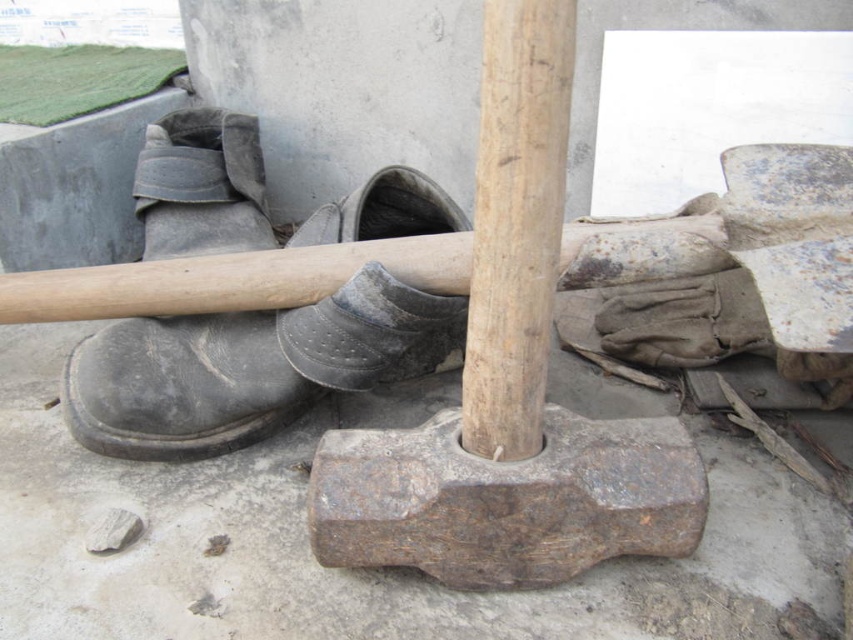
Which is behind, point (254, 333) or point (518, 104)?

The point (254, 333) is behind.

Is black leather boot at left to the left of smooth wood pole at center from the viewer's perspective?

Yes, black leather boot at left is to the left of smooth wood pole at center.

Is point (257, 358) farther from camera compared to point (465, 381)?

Yes.

At what (x,y) coordinates should I click in order to perform the action: click on black leather boot at left. Please return your answer as a coordinate pair (x, y). Looking at the image, I should click on (181, 387).

Does rusty metal shovel at center come in front of worn leather shoe at center?

That is True.

Can you confirm if rusty metal shovel at center is shorter than worn leather shoe at center?

No, rusty metal shovel at center is not shorter than worn leather shoe at center.

Does point (491, 314) come closer to viewer compared to point (305, 310)?

That is True.

In order to click on rusty metal shovel at center in this screenshot , I will do `click(509, 384)`.

Is smooth wood pole at center below worn leather shoe at center?

No.

Can you confirm if smooth wood pole at center is wider than worn leather shoe at center?

No, smooth wood pole at center is not wider than worn leather shoe at center.

In order to click on smooth wood pole at center in this screenshot , I will do `click(515, 224)`.